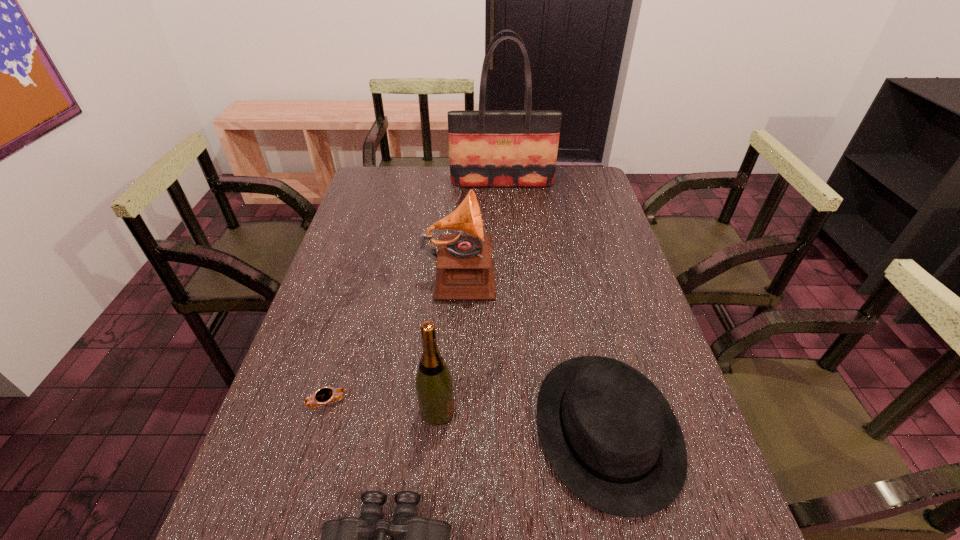
Identify the location of vacant space located 0.150m on the back of the fedora. Image resolution: width=960 pixels, height=540 pixels. (581, 315).

Identify the location of vacant area located 0.110m on the back of the leftmost object. (341, 355).

Locate an element on the screen. object that is at the far edge is located at coordinates (486, 148).

What are the coordinates of `object positioned at the left edge` in the screenshot? It's located at (326, 395).

Identify the location of object present at the right edge. (610, 435).

Where is `vacant space at the far edge of the desktop`? The image size is (960, 540). vacant space at the far edge of the desktop is located at coordinates (521, 188).

The image size is (960, 540). I want to click on vacant area at the left edge, so click(358, 286).

The width and height of the screenshot is (960, 540). I want to click on free space at the right edge of the desktop, so click(x=611, y=223).

Locate an element on the screen. This screenshot has width=960, height=540. free space at the far left corner is located at coordinates (374, 181).

This screenshot has height=540, width=960. What are the coordinates of `vacant position at the far right corner of the desktop` in the screenshot? It's located at (569, 168).